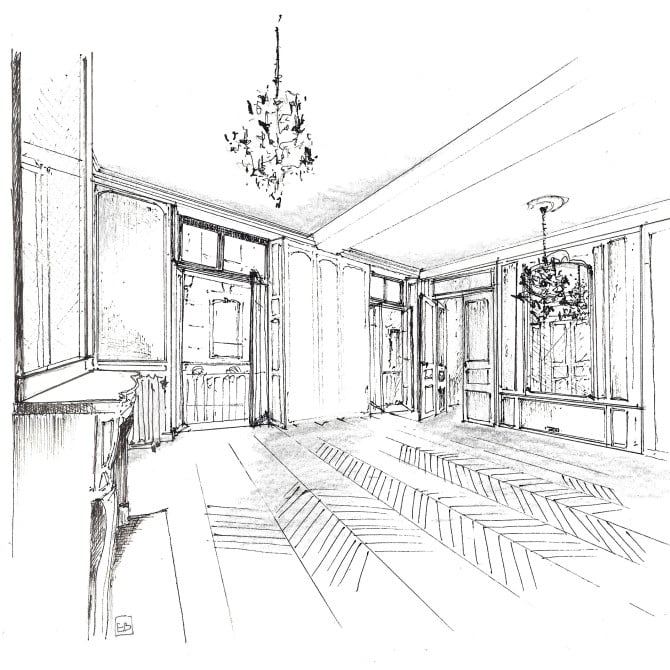
Image resolution: width=670 pixels, height=670 pixels. What are the coordinates of `hardwood floor` in the screenshot? It's located at (429, 543).